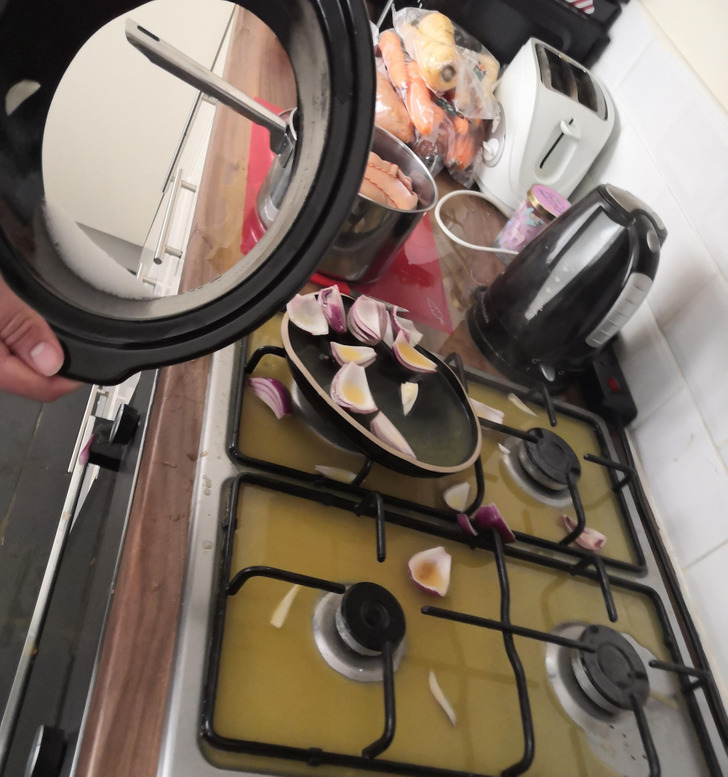
The width and height of the screenshot is (728, 777). Identify the location of wood counter top. (146, 629).